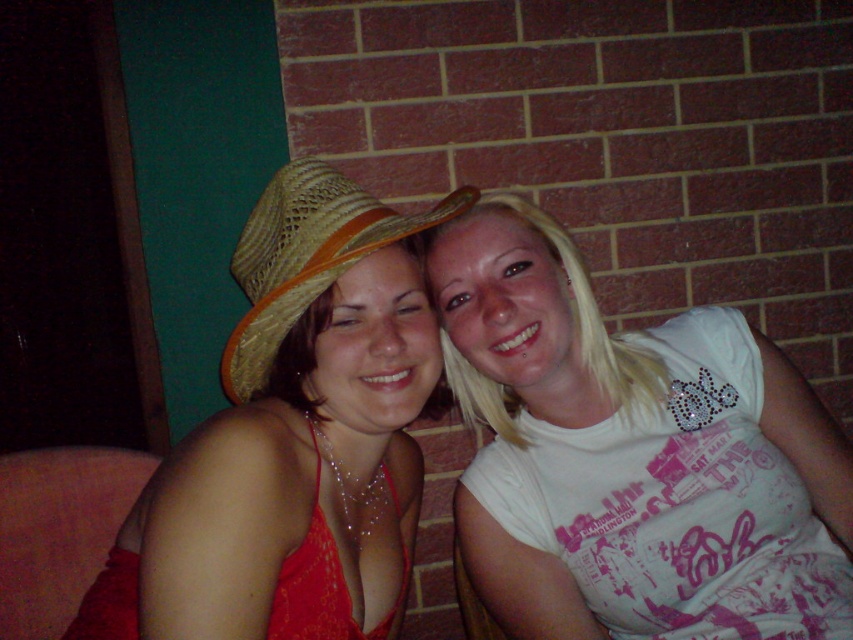
Can you confirm if white shiny t-shirt at center is wider than strawhat at center?

Indeed, white shiny t-shirt at center has a greater width compared to strawhat at center.

Locate an element on the screen. This screenshot has width=853, height=640. white shiny t-shirt at center is located at coordinates (631, 456).

Can you confirm if white shiny t-shirt at center is positioned above matte straw hat at left?

Actually, white shiny t-shirt at center is below matte straw hat at left.

Find the location of a particular element. white shiny t-shirt at center is located at coordinates (631, 456).

Locate an element on the screen. white shiny t-shirt at center is located at coordinates (631, 456).

Is matte straw hat at left shorter than strawhat at center?

No.

Does point (155, 637) come farther from viewer compared to point (260, 248)?

No, it is in front of (260, 248).

Identify the location of matte straw hat at left. (291, 438).

Locate an element on the screen. This screenshot has width=853, height=640. matte straw hat at left is located at coordinates (291, 438).